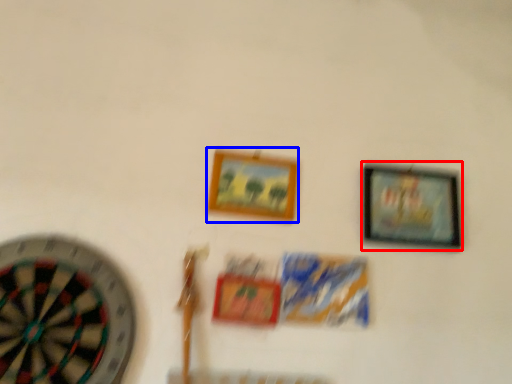
Question: Among these objects, which one is farthest to the camera, picture frame (highlighted by a red box) or picture frame (highlighted by a blue box)?

Choices:
 (A) picture frame
 (B) picture frame

Answer: (A)